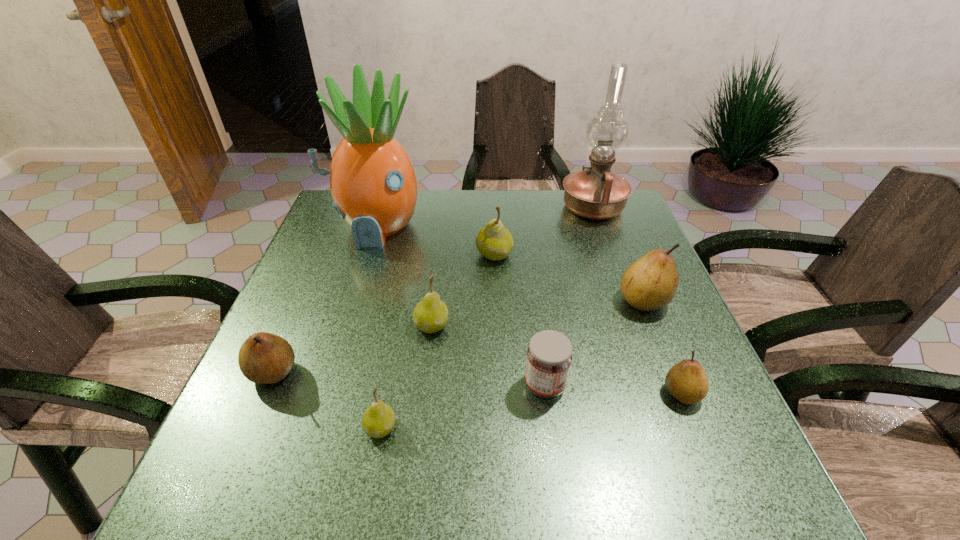
Select which green pear is the closest to the orange pineapple. Please provide its 2D coordinates. Your answer should be formatted as a tuple, i.e. [(x, y)], where the tuple contains the x and y coordinates of a point satisfying the conditions above.

[(494, 241)]

Identify which green pear is the second closest to the red jam. Please provide its 2D coordinates. Your answer should be formatted as a tuple, i.e. [(x, y)], where the tuple contains the x and y coordinates of a point satisfying the conditions above.

[(378, 420)]

You are a GUI agent. You are given a task and a screenshot of the screen. Output one action in this format:
    pyautogui.click(x=<x>, y=<y>)
    Task: Click on the blank space that satisfies the following two spatial constraints: 1. on the front side of the oil lamp; 2. on the left side of the biggest brown pear
    
    Given the screenshot: What is the action you would take?
    pyautogui.click(x=626, y=300)

Where is `vacant space that satisfies the following two spatial constraints: 1. on the back side of the oil lamp; 2. on the right side of the nearest green pear`? vacant space that satisfies the following two spatial constraints: 1. on the back side of the oil lamp; 2. on the right side of the nearest green pear is located at coordinates (421, 208).

Find the location of a particular element. The image size is (960, 540). free location that satisfies the following two spatial constraints: 1. at the entrance of the orange pineapple; 2. on the right side of the smallest green pear is located at coordinates (312, 428).

Where is `vacant region that satisfies the following two spatial constraints: 1. on the back side of the second farthest green pear; 2. on the left side of the leftmost brown pear`? The image size is (960, 540). vacant region that satisfies the following two spatial constraints: 1. on the back side of the second farthest green pear; 2. on the left side of the leftmost brown pear is located at coordinates (294, 326).

Where is `free space in the image that satisfies the following two spatial constraints: 1. at the entrance of the orange pineapple; 2. on the right side of the farthest brown pear`? Image resolution: width=960 pixels, height=540 pixels. free space in the image that satisfies the following two spatial constraints: 1. at the entrance of the orange pineapple; 2. on the right side of the farthest brown pear is located at coordinates (352, 300).